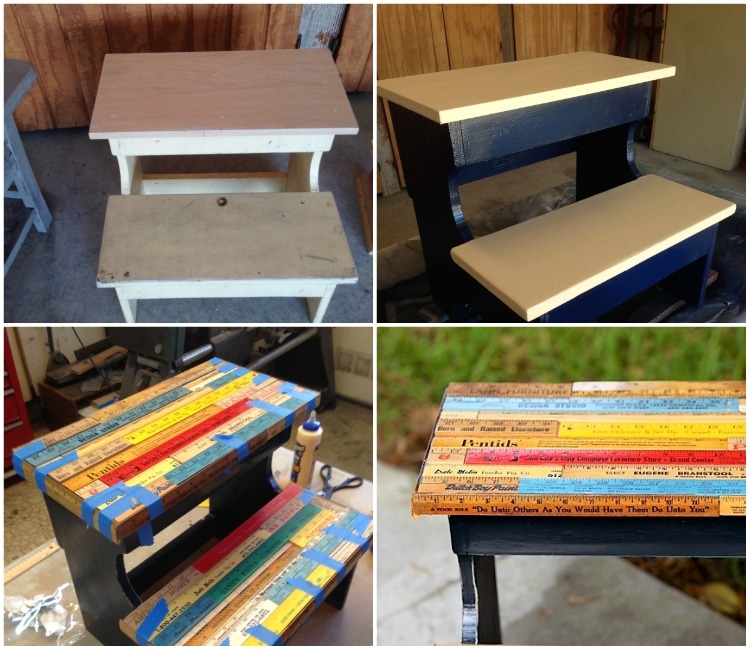
Locate an element on the screen. The image size is (750, 650). painted bench is located at coordinates (182, 465), (634, 504).